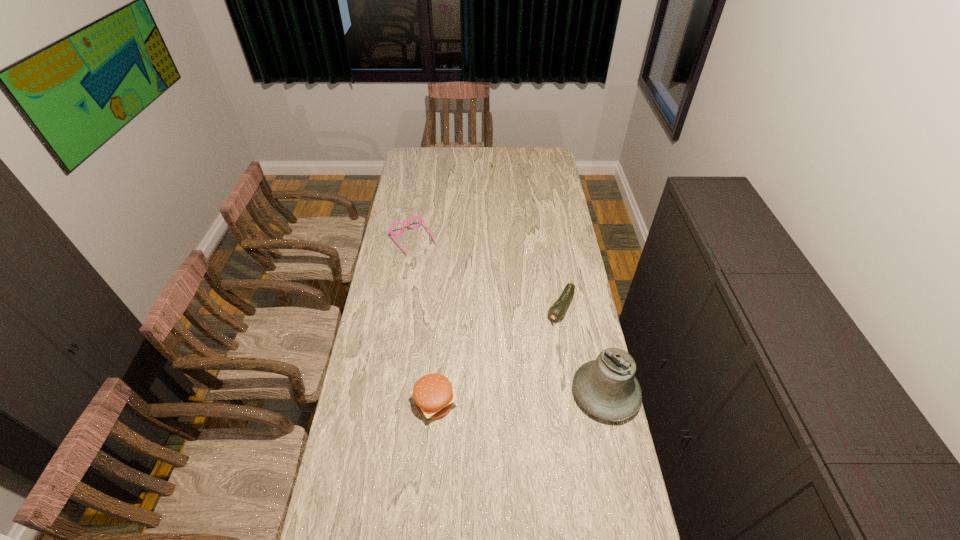
What are the coordinates of `blank space located 0.300m at the blossom end of the zucchini` in the screenshot? It's located at (518, 380).

Where is `free space located 0.280m at the blossom end of the zucchini`? free space located 0.280m at the blossom end of the zucchini is located at coordinates (521, 375).

I want to click on vacant region located 0.340m at the blossom end of the zucchini, so click(513, 388).

You are a GUI agent. You are given a task and a screenshot of the screen. Output one action in this format:
    pyautogui.click(x=<x>, y=<y>)
    Task: Click on the object situated at the left edge
    The width and height of the screenshot is (960, 540).
    Given the screenshot: What is the action you would take?
    pyautogui.click(x=421, y=219)

Locate an element on the screen. bell present at the right edge is located at coordinates pyautogui.click(x=607, y=388).

I want to click on zucchini at the right edge, so click(558, 309).

In the image, there is a desktop. What are the coordinates of `vacant space at the far edge` in the screenshot? It's located at (x=436, y=151).

Find the location of a particular element. The height and width of the screenshot is (540, 960). vacant space at the left edge is located at coordinates (375, 422).

The image size is (960, 540). In the image, there is a desktop. Find the location of `vacant space at the right edge`. vacant space at the right edge is located at coordinates (561, 380).

In the image, there is a desktop. Identify the location of blank space at the far left corner. The image size is (960, 540). (428, 167).